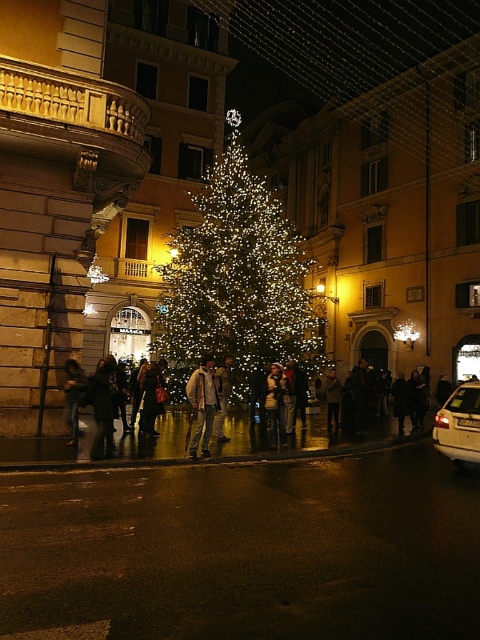
You are a photographer standing in the square and want to capture a photo of the illuminated glass christmas tree at center without the shiny metallic crowd at center appearing in the foreground. Is this possible based on their positions?

The illuminated glass christmas tree at center is located above the shiny metallic crowd at center, so if you angle your camera upwards to focus on the tree, you can avoid capturing the crowd in the foreground.

You are standing in the square and want to take a photo of the illuminated glass christmas tree at center and the shiny metallic crowd at center. If you position yourself so that the tree is on your left side, will the crowd be to your right or left?

The illuminated glass christmas tree at center is to the left of shiny metallic crowd at center, so if you position yourself with the tree on your left side, the crowd will be to your right.